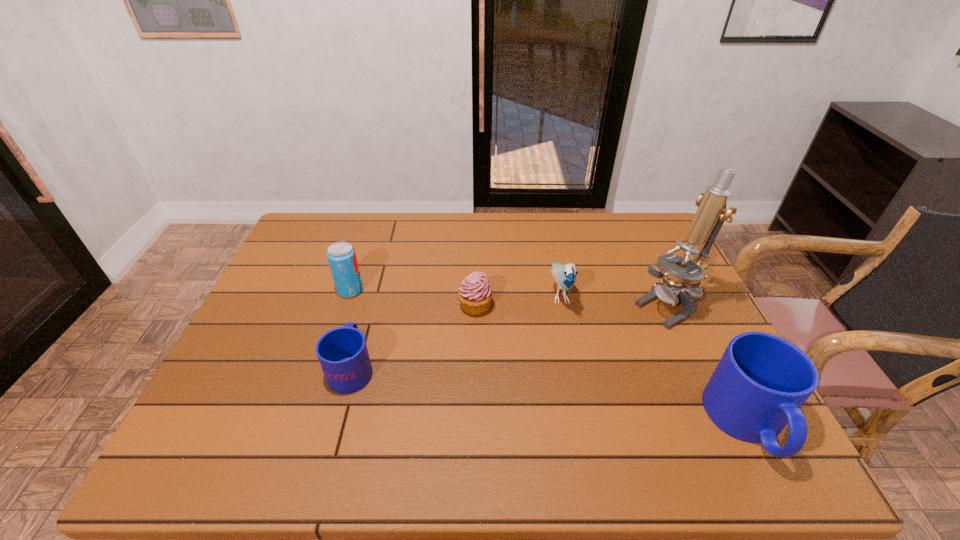
Please point a space for a new mug to maintain equal intervals. Please provide its 2D coordinates. Your answer should be formatted as a tuple, i.e. [(x, y)], where the tuple contains the x and y coordinates of a point satisfying the conditions above.

[(539, 394)]